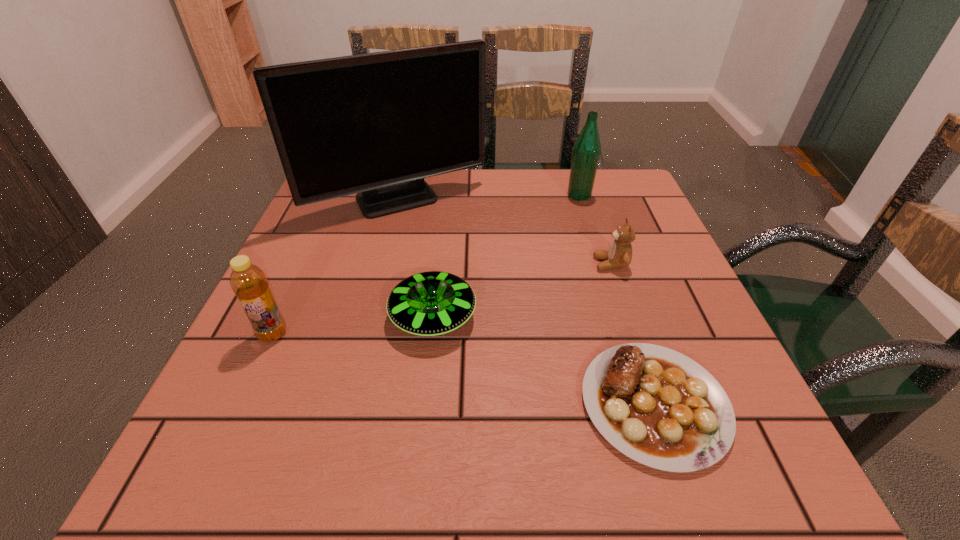
Locate an element on the screen. computer monitor at the left edge is located at coordinates (376, 124).

Where is `bottle located at the left edge`? bottle located at the left edge is located at coordinates (249, 283).

Where is `bottle at the right edge`? bottle at the right edge is located at coordinates (586, 152).

This screenshot has height=540, width=960. I want to click on teddy bear that is at the right edge, so click(x=619, y=255).

Where is `steak at the right edge`? Image resolution: width=960 pixels, height=540 pixels. steak at the right edge is located at coordinates (660, 408).

Where is `object at the far left corner`? The image size is (960, 540). object at the far left corner is located at coordinates (376, 124).

Locate an element on the screen. object at the far right corner is located at coordinates (586, 152).

Where is `object at the near right corner`? The image size is (960, 540). object at the near right corner is located at coordinates (660, 408).

At what (x,y) coordinates should I click in order to perform the action: click on free region at the far edge of the desktop. Please return your answer as a coordinate pair (x, y). Looking at the image, I should click on (472, 198).

The image size is (960, 540). Find the location of `vacant position at the left edge of the desktop`. vacant position at the left edge of the desktop is located at coordinates (268, 408).